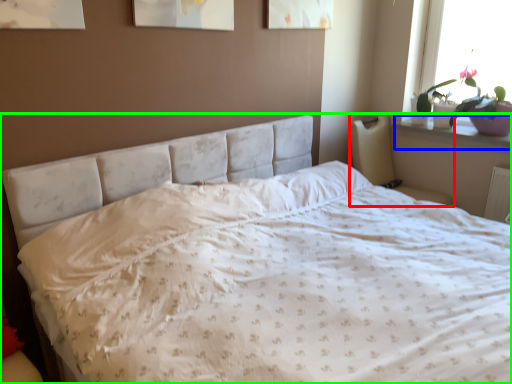
Question: Which is farther away from armchair (highlighted by a red box)? window sill (highlighted by a blue box) or bed (highlighted by a green box)?

Choices:
 (A) window sill
 (B) bed

Answer: (B)